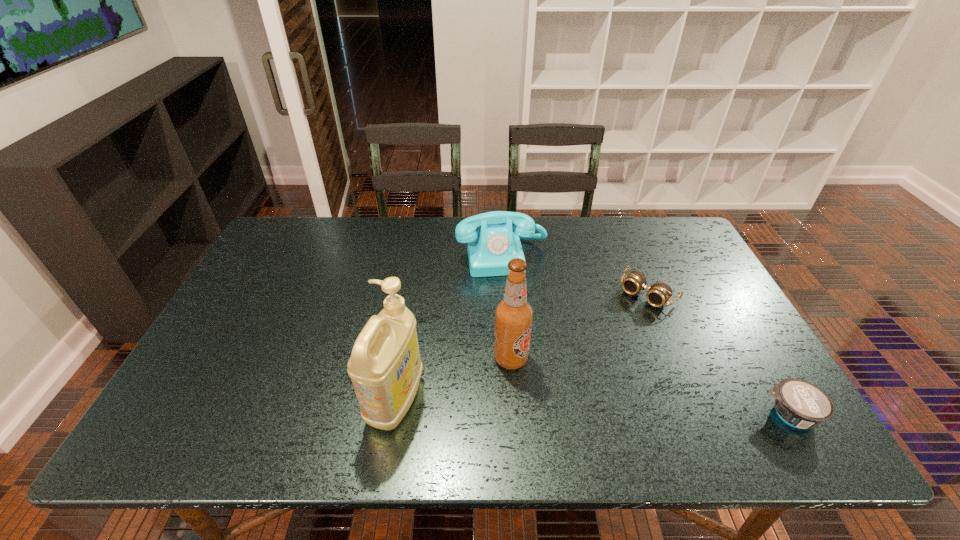
This screenshot has width=960, height=540. Find the location of `vacant area that lies between the beer bottle and the fourth object from left to right`. vacant area that lies between the beer bottle and the fourth object from left to right is located at coordinates (579, 326).

This screenshot has width=960, height=540. What are the coordinates of `empty location between the rightmost object and the telephone` in the screenshot? It's located at (646, 335).

The image size is (960, 540). Find the location of `free space between the yogurt and the beer bottle`. free space between the yogurt and the beer bottle is located at coordinates (650, 387).

This screenshot has height=540, width=960. In order to click on free area in between the yogurt and the third tallest object in this screenshot , I will do `click(646, 335)`.

Identify which object is located as the second nearest to the rightmost object. Please provide its 2D coordinates. Your answer should be formatted as a tuple, i.e. [(x, y)], where the tuple contains the x and y coordinates of a point satisfying the conditions above.

[(513, 314)]

Where is `object that stands as the closest to the third shortest object`? Image resolution: width=960 pixels, height=540 pixels. object that stands as the closest to the third shortest object is located at coordinates (659, 294).

Identify the location of free region that satisfies the following two spatial constraints: 1. on the front side of the third shortest object; 2. on the left side of the beer bottle. (508, 359).

Find the location of `vacant space that satisfies the following two spatial constraints: 1. on the front side of the third tallest object; 2. on the left side of the yogurt`. vacant space that satisfies the following two spatial constraints: 1. on the front side of the third tallest object; 2. on the left side of the yogurt is located at coordinates (512, 415).

Identify the location of free location that satisfies the following two spatial constraints: 1. on the back side of the leftmost object; 2. on the left side of the third shortest object. (420, 255).